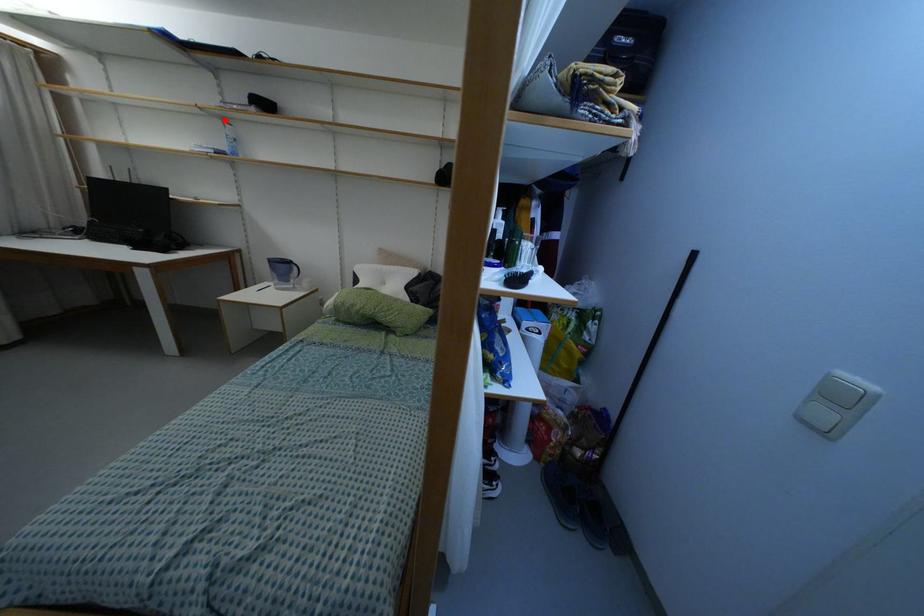
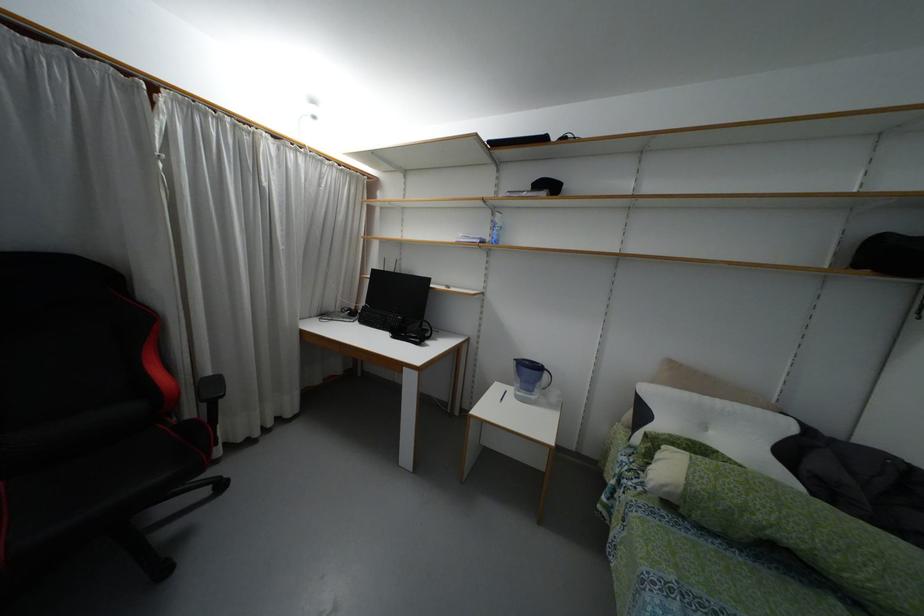
Question: I am providing you with two images of the same scene from different viewpoints. Given a red point in image1, look at the same physical point in image2. Is it:

Choices:
 (A) Closer to the viewpoint
 (B) Farther from the viewpoint

Answer: (A)